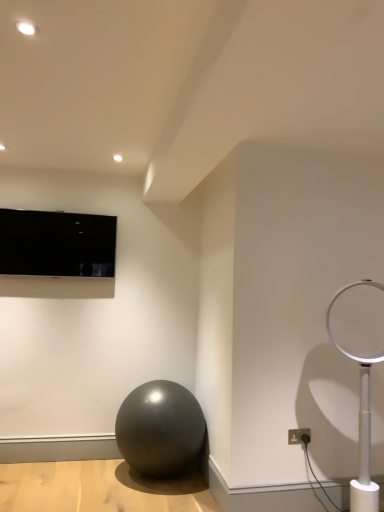
Question: Is point (3, 232) closer or farther from the camera than point (369, 306)?

Choices:
 (A) closer
 (B) farther

Answer: (B)

Question: From the image's perspective, relative to white plastic lamp at right, is matte black tv at upper left above or below?

Choices:
 (A) above
 (B) below

Answer: (A)

Question: Based on their relative distances, which object is nearer to the white plastic electric outlet at lower right?

Choices:
 (A) white plastic lamp at right
 (B) shiny black ball at center
 (C) matte black tv at upper left

Answer: (A)

Question: Which object is the closest to the white plastic lamp at right?

Choices:
 (A) white plastic electric outlet at lower right
 (B) shiny black ball at center
 (C) matte black tv at upper left

Answer: (A)